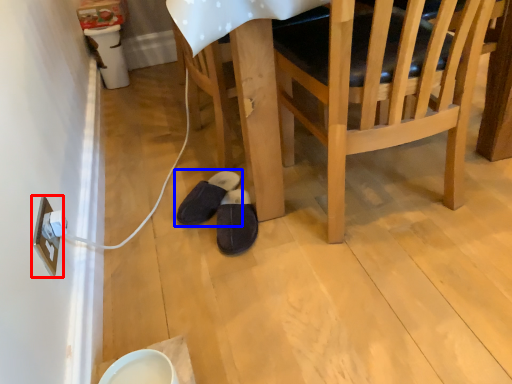
Question: Among these objects, which one is farthest to the camera, electric outlet (highlighted by a red box) or footwear (highlighted by a blue box)?

Choices:
 (A) electric outlet
 (B) footwear

Answer: (B)